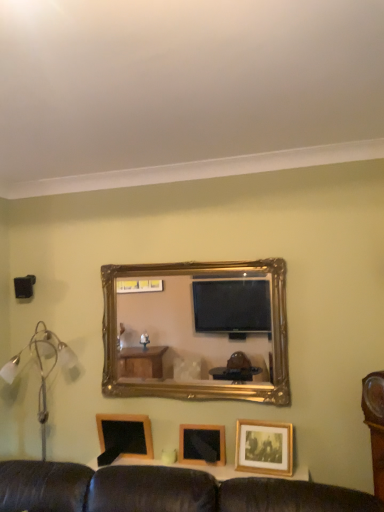
Find the location of a particular element. The image size is (384, 512). wooden picture frame at center, which appears as the 2th picture frame when viewed from the right is located at coordinates (202, 444).

Is gold/gilded mirror at center aimed at wooden blackboard at lower left, which is counted as the 1th picture frame, starting from the left?

No, gold/gilded mirror at center does not turn towards wooden blackboard at lower left, which is counted as the 1th picture frame, starting from the left.

How distant is gold/gilded mirror at center from wooden blackboard at lower left, which is the 3th picture frame from right to left?

A distance of 3.38 feet exists between gold/gilded mirror at center and wooden blackboard at lower left, which is the 3th picture frame from right to left.

Consider the image. Considering the sizes of objects gold/gilded mirror at center and wooden blackboard at lower left, which is the 3th picture frame from right to left, in the image provided, who is thinner, gold/gilded mirror at center or wooden blackboard at lower left, which is the 3th picture frame from right to left,?

Thinner between the two is wooden blackboard at lower left, which is the 3th picture frame from right to left.

This screenshot has width=384, height=512. I want to click on mirror to the right of wooden blackboard at lower left, which is the 3th picture frame from right to left, so 196,327.

Which is in front, point (52, 366) or point (121, 306)?

Positioned in front is point (52, 366).

Does silver metallic floor lamp at left have a lesser width compared to gold/gilded mirror at center?

In fact, silver metallic floor lamp at left might be wider than gold/gilded mirror at center.

Is black plastic speaker at left at the back of wooden picture frame at lower right, positioned as the 3th picture frame in left-to-right order?

wooden picture frame at lower right, positioned as the 3th picture frame in left-to-right order, does not have its back to black plastic speaker at left.

From the image's perspective, which object appears higher, wooden picture frame at lower right, positioned as the 3th picture frame in left-to-right order, or black plastic speaker at left?

black plastic speaker at left, from the image's perspective.

Which of these two, wooden picture frame at lower right, the first picture frame when ordered from right to left, or black plastic speaker at left, is thinner?

wooden picture frame at lower right, the first picture frame when ordered from right to left, is thinner.

What are the coordinates of `speaker positioned vertically above the wooden picture frame at lower right, positioned as the 3th picture frame in left-to-right order (from a real-world perspective)` in the screenshot? It's located at (24, 286).

What's the angular difference between silver metallic floor lamp at left and wooden picture frame at lower right, the first picture frame when ordered from right to left,'s facing directions?

The angle between the facing direction of silver metallic floor lamp at left and the facing direction of wooden picture frame at lower right, the first picture frame when ordered from right to left, is 3.63 degrees.

Considering the relative positions of silver metallic floor lamp at left and wooden picture frame at lower right, positioned as the 3th picture frame in left-to-right order, in the image provided, is silver metallic floor lamp at left in front of wooden picture frame at lower right, positioned as the 3th picture frame in left-to-right order,?

Yes, the depth of silver metallic floor lamp at left is less than that of wooden picture frame at lower right, positioned as the 3th picture frame in left-to-right order.

Where is `table lamp that appears above the wooden picture frame at lower right, the first picture frame when ordered from right to left (from a real-world perspective)`? table lamp that appears above the wooden picture frame at lower right, the first picture frame when ordered from right to left (from a real-world perspective) is located at coordinates (41, 367).

Is silver metallic floor lamp at left aimed at wooden picture frame at lower right, the first picture frame when ordered from right to left?

No, silver metallic floor lamp at left is not turned towards wooden picture frame at lower right, the first picture frame when ordered from right to left.

From the image's perspective, who appears lower, gold/gilded mirror at center or black plastic speaker at left?

From the image's view, gold/gilded mirror at center is below.

Is point (203, 292) positioned before point (23, 284)?

That is False.

Can you confirm if gold/gilded mirror at center is positioned to the left of black plastic speaker at left?

In fact, gold/gilded mirror at center is to the right of black plastic speaker at left.

How much distance is there between gold/gilded mirror at center and black plastic speaker at left?

gold/gilded mirror at center is 1.31 meters away from black plastic speaker at left.

Visually, is wooden blackboard at lower left, which is counted as the 1th picture frame, starting from the left, positioned to the left or to the right of gold/gilded mirror at center?

wooden blackboard at lower left, which is counted as the 1th picture frame, starting from the left, is positioned on gold/gilded mirror at center's left side.

In terms of size, does wooden blackboard at lower left, which is counted as the 1th picture frame, starting from the left, appear bigger or smaller than gold/gilded mirror at center?

Considering their sizes, wooden blackboard at lower left, which is counted as the 1th picture frame, starting from the left, takes up less space than gold/gilded mirror at center.

Does wooden blackboard at lower left, which is counted as the 1th picture frame, starting from the left, turn towards gold/gilded mirror at center?

No.

Does wooden blackboard at lower left, which is the 3th picture frame from right to left, have a greater height compared to gold/gilded mirror at center?

Incorrect, the height of wooden blackboard at lower left, which is the 3th picture frame from right to left, is not larger of that of gold/gilded mirror at center.

From a real-world perspective, is wooden picture frame at lower right, positioned as the 3th picture frame in left-to-right order, physically located above or below wooden blackboard at lower left, which is the 3th picture frame from right to left?

In terms of real-world spatial position, wooden picture frame at lower right, positioned as the 3th picture frame in left-to-right order, is below wooden blackboard at lower left, which is the 3th picture frame from right to left.

From the image's perspective, who appears lower, wooden picture frame at lower right, the first picture frame when ordered from right to left, or wooden blackboard at lower left, which is the 3th picture frame from right to left?

wooden blackboard at lower left, which is the 3th picture frame from right to left, is shown below in the image.

Who is shorter, wooden picture frame at lower right, the first picture frame when ordered from right to left, or wooden blackboard at lower left, which is counted as the 1th picture frame, starting from the left?

With less height is wooden blackboard at lower left, which is counted as the 1th picture frame, starting from the left.

Is wooden picture frame at lower right, the first picture frame when ordered from right to left, smaller than wooden blackboard at lower left, which is the 3th picture frame from right to left?

Yes, wooden picture frame at lower right, the first picture frame when ordered from right to left, is smaller than wooden blackboard at lower left, which is the 3th picture frame from right to left.

Locate an element on the screen. The image size is (384, 512). mirror on the right of wooden blackboard at lower left, which is the 3th picture frame from right to left is located at coordinates click(x=196, y=327).

Locate an element on the screen. This screenshot has width=384, height=512. mirror above the silver metallic floor lamp at left (from the image's perspective) is located at coordinates (196, 327).

Looking at the image, which one is located closer to silver metallic floor lamp at left, gold/gilded mirror at center or wooden picture frame at center, which appears as the 2th picture frame when viewed from the right?

wooden picture frame at center, which appears as the 2th picture frame when viewed from the right, is positioned closer to the anchor silver metallic floor lamp at left.

When comparing their distances from silver metallic floor lamp at left, does wooden blackboard at lower left, which is the 3th picture frame from right to left, or gold/gilded mirror at center seem further?

gold/gilded mirror at center is further to silver metallic floor lamp at left.

Which object lies further to the anchor point black plastic speaker at left, gold/gilded mirror at center or wooden picture frame at center, which appears as the 2th picture frame when viewed from the right?

wooden picture frame at center, which appears as the 2th picture frame when viewed from the right, is further to black plastic speaker at left.

From the image, which object appears to be farther from wooden blackboard at lower left, which is the 3th picture frame from right to left, black plastic speaker at left or wooden picture frame at center, arranged as the second picture frame when viewed from the left?

The object further to wooden blackboard at lower left, which is the 3th picture frame from right to left, is black plastic speaker at left.

Which object lies nearer to the anchor point wooden picture frame at lower right, positioned as the 3th picture frame in left-to-right order, wooden picture frame at center, which appears as the 2th picture frame when viewed from the right, or wooden blackboard at lower left, which is counted as the 1th picture frame, starting from the left?

wooden picture frame at center, which appears as the 2th picture frame when viewed from the right, is closer to wooden picture frame at lower right, positioned as the 3th picture frame in left-to-right order.

Which object lies nearer to the anchor point black plastic speaker at left, wooden blackboard at lower left, which is the 3th picture frame from right to left, or gold/gilded mirror at center?

The object closer to black plastic speaker at left is wooden blackboard at lower left, which is the 3th picture frame from right to left.

From the image, which object appears to be farther from wooden blackboard at lower left, which is the 3th picture frame from right to left, silver metallic floor lamp at left or gold/gilded mirror at center?

gold/gilded mirror at center.

Which object lies nearer to the anchor point black plastic speaker at left, silver metallic floor lamp at left or wooden picture frame at center, which appears as the 2th picture frame when viewed from the right?

silver metallic floor lamp at left is closer to black plastic speaker at left.

Identify the location of table lamp between black plastic speaker at left and wooden picture frame at lower right, the first picture frame when ordered from right to left, from left to right. This screenshot has height=512, width=384. (41, 367).

You are a GUI agent. You are given a task and a screenshot of the screen. Output one action in this format:
    pyautogui.click(x=<x>, y=<y>)
    Task: Click on the picture frame situated between black plastic speaker at left and wooden picture frame at center, arranged as the second picture frame when viewed from the left, from left to right
    
    Given the screenshot: What is the action you would take?
    pyautogui.click(x=126, y=434)

You are a GUI agent. You are given a task and a screenshot of the screen. Output one action in this format:
    pyautogui.click(x=<x>, y=<y>)
    Task: Click on the table lamp that lies between black plastic speaker at left and wooden blackboard at lower left, which is counted as the 1th picture frame, starting from the left, from top to bottom
    This screenshot has width=384, height=512.
    Given the screenshot: What is the action you would take?
    pyautogui.click(x=41, y=367)

Identify the location of table lamp between black plastic speaker at left and wooden picture frame at center, arranged as the second picture frame when viewed from the left. (41, 367).